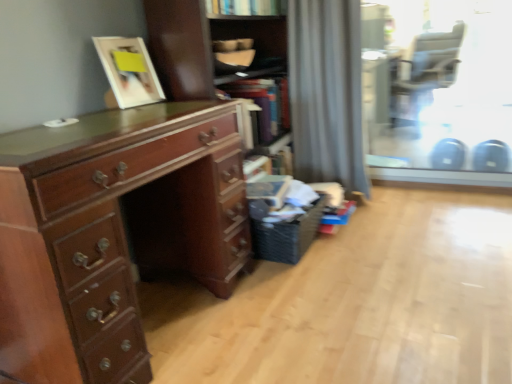
Question: Is shiny brown wooden desk at left bigger than wooden cabinet at center?

Choices:
 (A) yes
 (B) no

Answer: (B)

Question: From a real-world perspective, is shiny brown wooden desk at left physically below wooden cabinet at center?

Choices:
 (A) no
 (B) yes

Answer: (B)

Question: Does shiny brown wooden desk at left lie behind wooden cabinet at center?

Choices:
 (A) no
 (B) yes

Answer: (A)

Question: From the image's perspective, is shiny brown wooden desk at left under wooden cabinet at center?

Choices:
 (A) no
 (B) yes

Answer: (B)

Question: Is the depth of shiny brown wooden desk at left less than that of wooden cabinet at center?

Choices:
 (A) yes
 (B) no

Answer: (A)

Question: Is wooden cabinet at center at the back of shiny brown wooden desk at left?

Choices:
 (A) yes
 (B) no

Answer: (B)

Question: Considering the relative positions of matte white picture frame at upper left and gray fabric curtain at center in the image provided, is matte white picture frame at upper left behind gray fabric curtain at center?

Choices:
 (A) no
 (B) yes

Answer: (A)

Question: Considering the relative sizes of matte white picture frame at upper left and gray fabric curtain at center in the image provided, is matte white picture frame at upper left thinner than gray fabric curtain at center?

Choices:
 (A) yes
 (B) no

Answer: (A)

Question: From the image's perspective, is matte white picture frame at upper left over gray fabric curtain at center?

Choices:
 (A) yes
 (B) no

Answer: (B)

Question: Does matte white picture frame at upper left have a larger size compared to gray fabric curtain at center?

Choices:
 (A) yes
 (B) no

Answer: (B)

Question: Can you confirm if matte white picture frame at upper left is wider than gray fabric curtain at center?

Choices:
 (A) no
 (B) yes

Answer: (A)

Question: Considering the relative positions of matte white picture frame at upper left and gray fabric curtain at center in the image provided, is matte white picture frame at upper left to the left of gray fabric curtain at center from the viewer's perspective?

Choices:
 (A) no
 (B) yes

Answer: (B)

Question: Is matte black armchair at upper right looking in the opposite direction of gray fabric curtain at center?

Choices:
 (A) no
 (B) yes

Answer: (A)